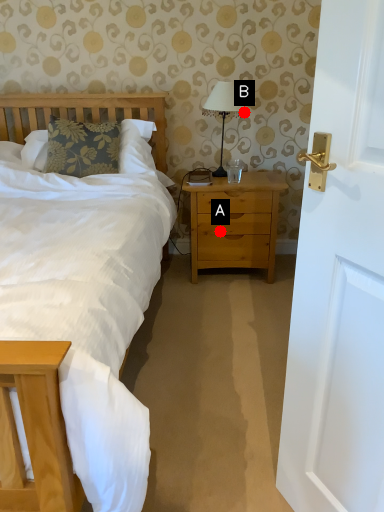
Question: Two points are circled on the image, labeled by A and B beside each circle. Which point is farther to the camera?

Choices:
 (A) A is further
 (B) B is further

Answer: (B)